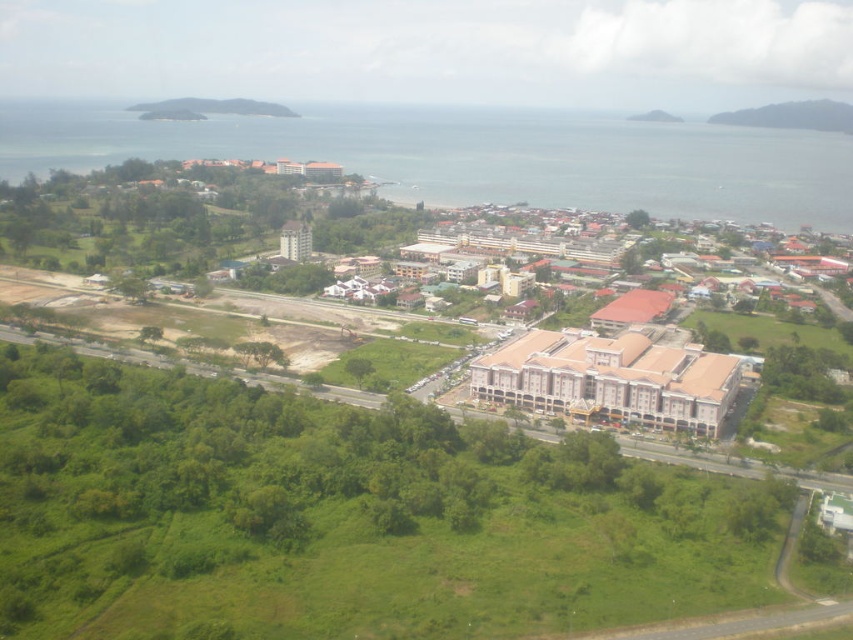
You are a delivery drone flying over the coastal urban area. Your GPS shows a point at coordinates (323, 227). Based on the scene, where is this point located?

The point at coordinates (323, 227) is on a brown brick building at center.